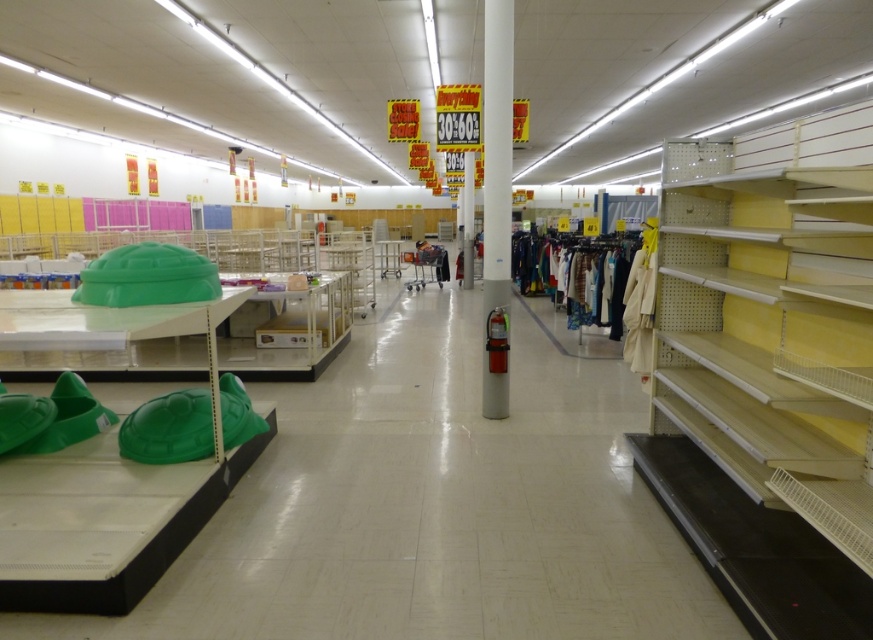
Question: Which point is closer to the camera?

Choices:
 (A) (510, 65)
 (B) (806, 480)

Answer: (B)

Question: Among these objects, which one is farthest from the camera?

Choices:
 (A) metallic yellow shelf at right
 (B) white glossy fire extinguisher at center

Answer: (B)

Question: Considering the relative positions of metallic yellow shelf at right and white glossy fire extinguisher at center in the image provided, where is metallic yellow shelf at right located with respect to white glossy fire extinguisher at center?

Choices:
 (A) above
 (B) below

Answer: (B)

Question: Can you confirm if metallic yellow shelf at right is wider than white glossy fire extinguisher at center?

Choices:
 (A) no
 (B) yes

Answer: (B)

Question: Does metallic yellow shelf at right appear under white glossy fire extinguisher at center?

Choices:
 (A) yes
 (B) no

Answer: (A)

Question: Among these points, which one is nearest to the camera?

Choices:
 (A) (837, 513)
 (B) (507, 182)

Answer: (A)